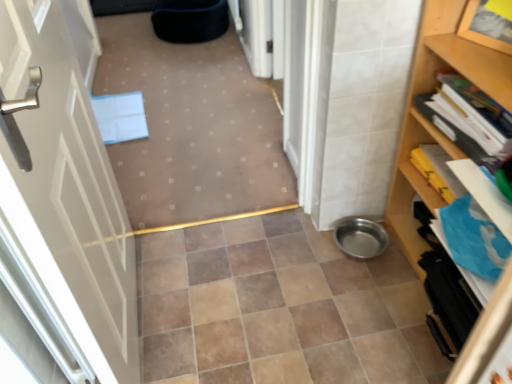
The height and width of the screenshot is (384, 512). What are the coordinates of `vacant space in white glossy door at left (from a real-world perspective)` in the screenshot? It's located at (147, 316).